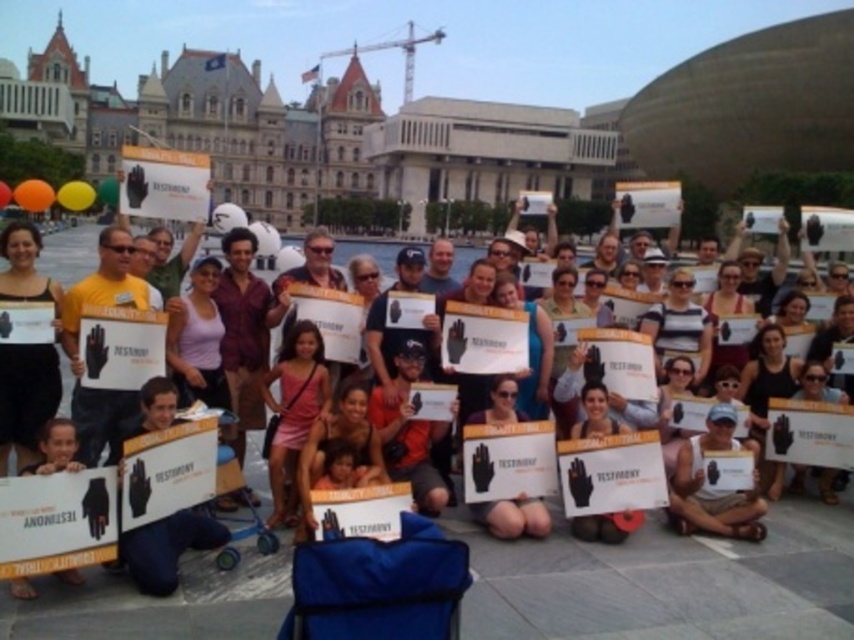
Is matte black sign at center thinner than white cotton tank top at center?

Incorrect, matte black sign at center's width is not less than white cotton tank top at center's.

This screenshot has width=854, height=640. Describe the element at coordinates (671, 570) in the screenshot. I see `matte black sign at center` at that location.

Where is `matte black sign at center`? This screenshot has width=854, height=640. matte black sign at center is located at coordinates (671, 570).

Between white cotton tank top at center and matte black hand at lower left, which one appears on the right side from the viewer's perspective?

From the viewer's perspective, white cotton tank top at center appears more on the right side.

Between point (727, 509) and point (73, 444), which one is positioned in front?

Positioned in front is point (73, 444).

Which is behind, point (717, 435) or point (48, 435)?

The point (717, 435) is more distant.

Locate an element on the screen. white cotton tank top at center is located at coordinates (712, 490).

Is point (519, 529) closer to viewer compared to point (19, 589)?

No, it is not.

Is point (506, 518) closer to viewer compared to point (44, 433)?

No, it is behind (44, 433).

At what (x,y) coordinates should I click in order to perform the action: click on matte black glove at center. Please return your answer as a coordinate pair (x, y). This screenshot has width=854, height=640. Looking at the image, I should click on (513, 516).